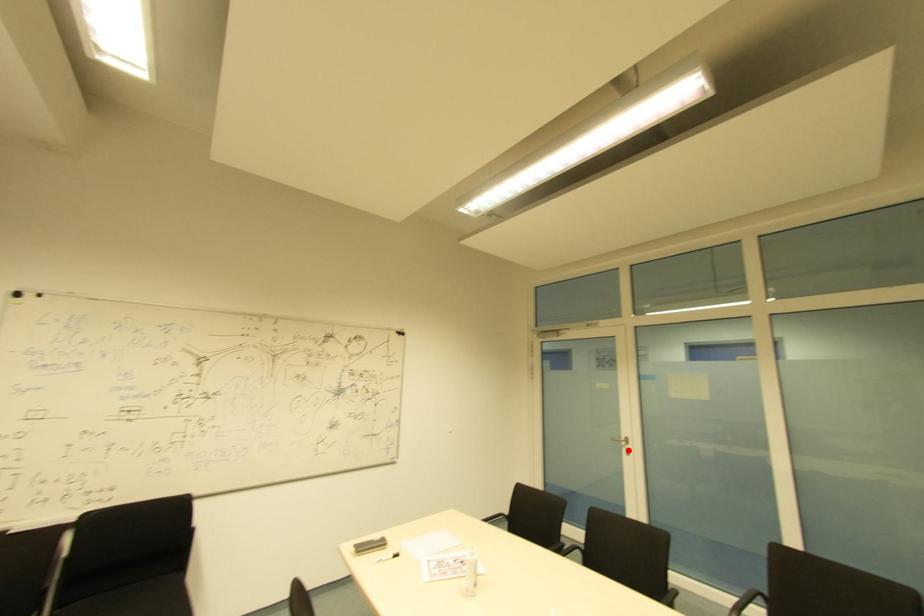
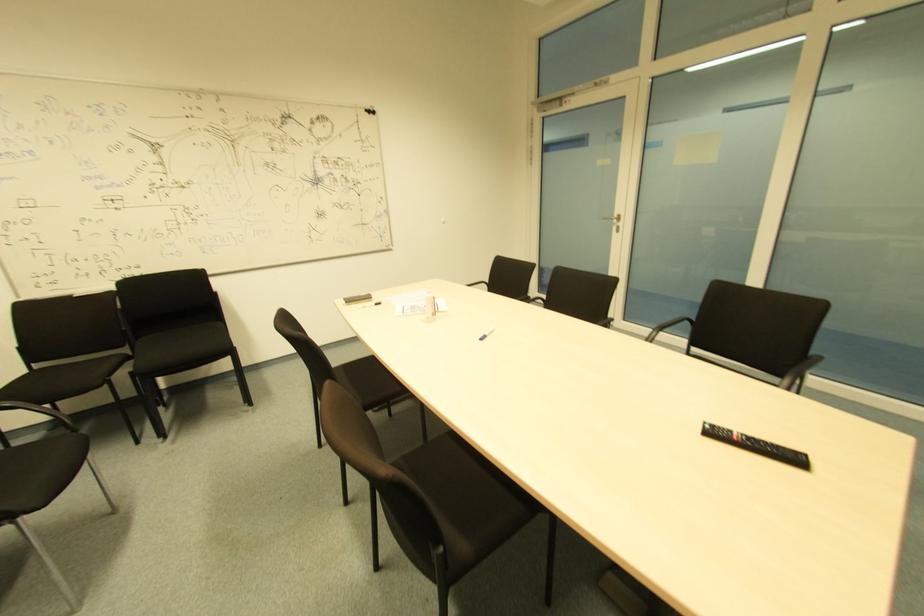
Question: A red point is marked in image1. In image2, is the corresponding 3D point closer to the camera or farther? Reply with the corresponding letter.

Choices:
 (A) The corresponding 3D point is closer.
 (B) The corresponding 3D point is farther.

Answer: (A)